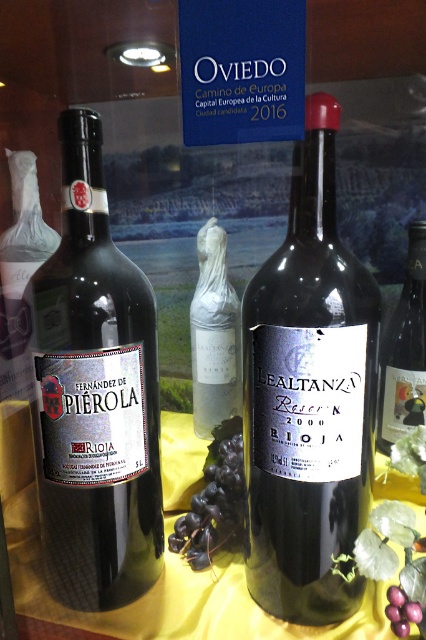
Who is shorter, shiny dark glass bottle at center or matte black bottle at left?

shiny dark glass bottle at center is shorter.

Between shiny dark glass bottle at center and matte black bottle at left, which one is positioned higher?

matte black bottle at left

Is point (282, 618) more distant than point (103, 381)?

Yes.

Identify the location of shiny dark glass bottle at center. (308, 396).

Between white matte bottle at center and matte glass wine at center, which one is positioned lower?

matte glass wine at center

Who is higher up, white matte bottle at center or matte glass wine at center?

white matte bottle at center is above.

Is point (230, 355) more distant than point (405, 413)?

That is True.

This screenshot has width=426, height=640. What are the coordinates of `white matte bottle at center` in the screenshot? It's located at (213, 336).

Does matte black bottle at left have a lesser height compared to matte glass wine at center?

Incorrect, matte black bottle at left's height does not fall short of matte glass wine at center's.

Who is more forward, (138, 371) or (391, 381)?

Positioned in front is point (138, 371).

I want to click on matte black bottle at left, so click(x=94, y=396).